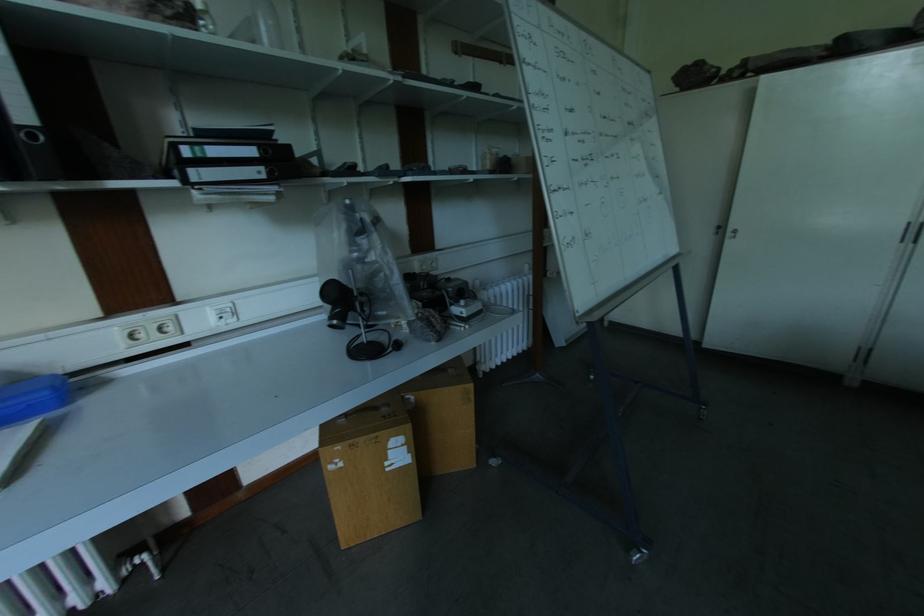
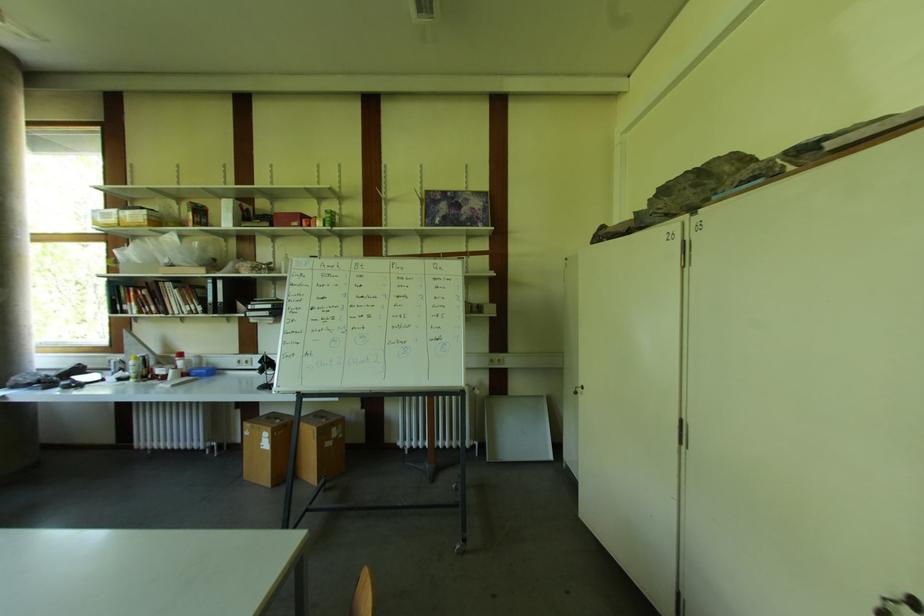
Locate, in the second image, the point that corresponds to [737,238] in the first image.

(578, 395)